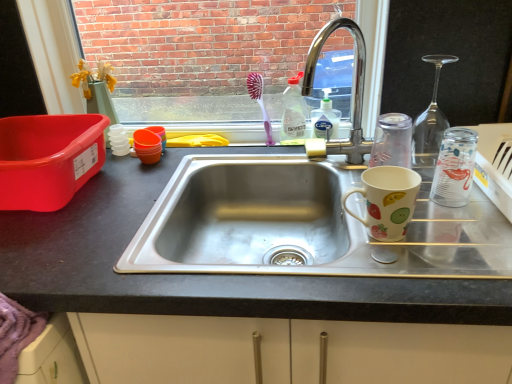
Question: Is matte ceramic mug at right located within translucent plastic bottle at upper center, acting as the first bottle starting from the top?

Choices:
 (A) no
 (B) yes

Answer: (A)

Question: Is translucent plastic bottle at upper center, arranged as the 2th bottle when viewed from the right, positioned beyond the bounds of matte ceramic mug at right?

Choices:
 (A) no
 (B) yes

Answer: (B)

Question: Considering the relative sizes of translucent plastic bottle at upper center, arranged as the 2th bottle when viewed from the right, and matte ceramic mug at right in the image provided, is translucent plastic bottle at upper center, arranged as the 2th bottle when viewed from the right, bigger than matte ceramic mug at right?

Choices:
 (A) no
 (B) yes

Answer: (A)

Question: Does translucent plastic bottle at upper center, the 2th bottle viewed from the front, have a greater width compared to matte ceramic mug at right?

Choices:
 (A) yes
 (B) no

Answer: (B)

Question: Can you confirm if translucent plastic bottle at upper center, the 1th bottle viewed from the back, is taller than matte ceramic mug at right?

Choices:
 (A) yes
 (B) no

Answer: (A)

Question: Choose the correct answer: Is transparent glass bottle at right, the second bottle positioned from the back, inside matte ceramic mug at right or outside it?

Choices:
 (A) outside
 (B) inside

Answer: (A)

Question: In the image, is transparent glass bottle at right, which is the first bottle in front-to-back order, positioned in front of or behind matte ceramic mug at right?

Choices:
 (A) behind
 (B) front

Answer: (A)

Question: Is transparent glass bottle at right, which is the first bottle in front-to-back order, to the left or to the right of matte ceramic mug at right in the image?

Choices:
 (A) left
 (B) right

Answer: (B)

Question: From the image's perspective, is transparent glass bottle at right, which is the first bottle in front-to-back order, above or below matte ceramic mug at right?

Choices:
 (A) below
 (B) above

Answer: (B)

Question: From a real-world perspective, is chrome/metallic faucet at upper center physically located above or below matte ceramic mug at right?

Choices:
 (A) below
 (B) above

Answer: (B)

Question: Visually, is chrome/metallic faucet at upper center positioned to the left or to the right of matte ceramic mug at right?

Choices:
 (A) left
 (B) right

Answer: (A)

Question: From the image's perspective, is chrome/metallic faucet at upper center positioned above or below matte ceramic mug at right?

Choices:
 (A) below
 (B) above

Answer: (B)

Question: In terms of height, does chrome/metallic faucet at upper center look taller or shorter compared to matte ceramic mug at right?

Choices:
 (A) short
 (B) tall

Answer: (B)

Question: In terms of width, does chrome/metallic faucet at upper center look wider or thinner when compared to transparent glass bottle at right, which is the first bottle in front-to-back order?

Choices:
 (A) wide
 (B) thin

Answer: (A)

Question: Choose the correct answer: Is chrome/metallic faucet at upper center inside transparent glass bottle at right, marked as the first bottle in a bottom-to-top arrangement, or outside it?

Choices:
 (A) outside
 (B) inside

Answer: (A)